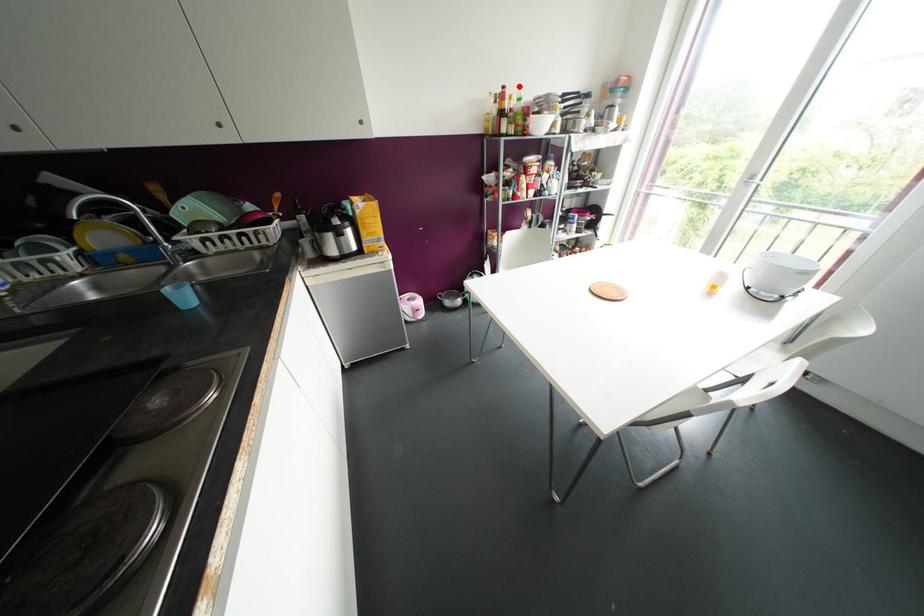
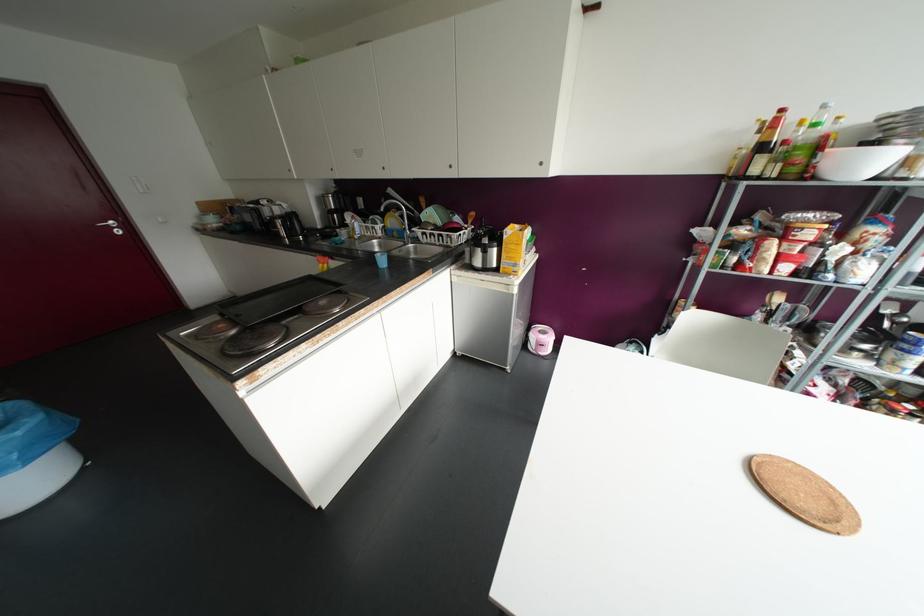
Locate, in the second image, the point that corresponds to the highlighted location in the first image.

(823, 106)